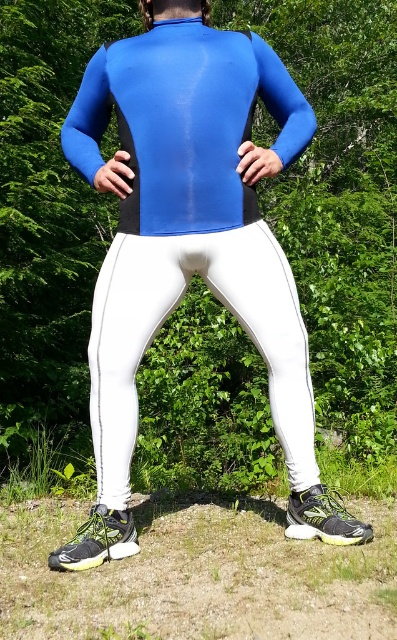
Describe the element at coordinates (169, 314) in the screenshot. I see `white matte leggings at center` at that location.

Is white matte leggings at center closer to the viewer compared to green grass at lower center?

Yes, it is in front of green grass at lower center.

Does point (271, 401) come closer to viewer compared to point (42, 436)?

Yes, point (271, 401) is closer to viewer.

You are a GUI agent. You are given a task and a screenshot of the screen. Output one action in this format:
    pyautogui.click(x=<x>, y=<y>)
    Task: Click on the white matte leggings at center
    Image resolution: width=397 pixels, height=640 pixels.
    Given the screenshot: What is the action you would take?
    pyautogui.click(x=169, y=314)